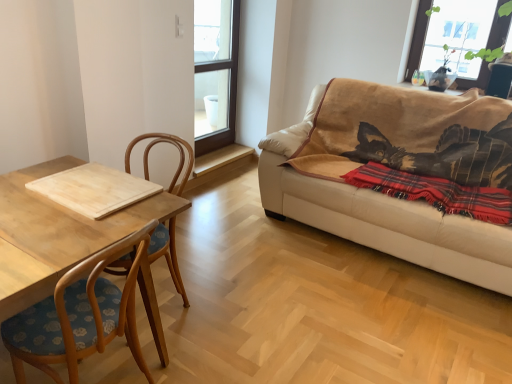
Find the location of a particular element. Image resolution: width=512 pixels, height=384 pixels. red plaid blanket at right is located at coordinates (436, 192).

What is the approximate width of light wood cutting board at left?

light wood cutting board at left is 81.60 centimeters in width.

The height and width of the screenshot is (384, 512). Find the location of `light wood cutting board at left`. light wood cutting board at left is located at coordinates (57, 234).

The image size is (512, 384). What do you see at coordinates (378, 210) in the screenshot? I see `beige leather couch at right` at bounding box center [378, 210].

You are a GUI agent. You are given a task and a screenshot of the screen. Output one action in this format:
    pyautogui.click(x=<x>, y=<y>)
    Task: Click on the beige leather couch at right
    This screenshot has width=512, height=384.
    Given the screenshot: What is the action you would take?
    pyautogui.click(x=378, y=210)

The height and width of the screenshot is (384, 512). What are the coordinates of `transparent glass window at upper right, which is the first window from right to left` in the screenshot? It's located at (418, 39).

Where is `transparent glass window at upper center, arranged as the 2th window when viewed from the right`? The image size is (512, 384). transparent glass window at upper center, arranged as the 2th window when viewed from the right is located at coordinates (215, 73).

Can you confirm if light wood cutting board at left is smaller than transparent glass window at upper right, which is counted as the second window, starting from the left?

Correct, light wood cutting board at left occupies less space than transparent glass window at upper right, which is counted as the second window, starting from the left.

How different are the orientations of light wood cutting board at left and transparent glass window at upper right, which is the first window from right to left, in degrees?

light wood cutting board at left and transparent glass window at upper right, which is the first window from right to left, are facing 1.83 degrees away from each other.

Starting from the light wood cutting board at left, which window is the 2nd one to the right? Please provide its 2D coordinates.

[(418, 39)]

Does beige leather couch at right have a lesser width compared to transparent glass window at upper right, which is the first window from right to left?

Incorrect, the width of beige leather couch at right is not less than that of transparent glass window at upper right, which is the first window from right to left.

Is transparent glass window at upper right, which is the first window from right to left, surrounded by beige leather couch at right?

No, beige leather couch at right does not contain transparent glass window at upper right, which is the first window from right to left.

Is beige leather couch at right at the right side of transparent glass window at upper right, which is counted as the second window, starting from the left?

In fact, beige leather couch at right is to the left of transparent glass window at upper right, which is counted as the second window, starting from the left.

From a real-world perspective, is beige leather couch at right under transparent glass window at upper right, which is the first window from right to left?

Correct, in the physical world, beige leather couch at right is lower than transparent glass window at upper right, which is the first window from right to left.

Is transparent glass window at upper center, which is the first window from left to right, further to the viewer compared to red plaid blanket at right?

Yes, transparent glass window at upper center, which is the first window from left to right, is further from the camera.

Is red plaid blanket at right at the back of transparent glass window at upper center, which is the first window from left to right?

That's not correct — transparent glass window at upper center, which is the first window from left to right, is not looking away from red plaid blanket at right.

At what (x,y) coordinates should I click in order to perform the action: click on blanket located below the transparent glass window at upper center, which is the first window from left to right (from the image's perspective). Please return your answer as a coordinate pair (x, y). The height and width of the screenshot is (384, 512). Looking at the image, I should click on [436, 192].

Is transparent glass window at upper center, arranged as the 2th window when viewed from the right, with red plaid blanket at right?

No, transparent glass window at upper center, arranged as the 2th window when viewed from the right, is not in contact with red plaid blanket at right.

From a real-world perspective, is red plaid blanket at right positioned above or below light wood cutting board at left?

red plaid blanket at right is below light wood cutting board at left.

Is red plaid blanket at right at the right side of light wood cutting board at left?

Yes, red plaid blanket at right is to the right of light wood cutting board at left.

From the image's perspective, does red plaid blanket at right appear higher than light wood cutting board at left?

Yes, from the image's perspective, red plaid blanket at right is above light wood cutting board at left.

Is point (418, 198) closer to viewer compared to point (64, 202)?

No.

From the image's perspective, relative to light wood cutting board at left, is transparent glass window at upper center, which is the first window from left to right, above or below?

From the image's perspective, transparent glass window at upper center, which is the first window from left to right, appears above light wood cutting board at left.

Find the location of `coffee table below the transparent glass window at upper center, which is the first window from left to right (from a real-world perspective)`. coffee table below the transparent glass window at upper center, which is the first window from left to right (from a real-world perspective) is located at coordinates (57, 234).

Measure the distance between transparent glass window at upper center, arranged as the 2th window when viewed from the right, and light wood cutting board at left.

transparent glass window at upper center, arranged as the 2th window when viewed from the right, is 2.32 meters from light wood cutting board at left.

Considering the relative sizes of transparent glass window at upper right, which is the first window from right to left, and red plaid blanket at right in the image provided, is transparent glass window at upper right, which is the first window from right to left, wider than red plaid blanket at right?

Answer: No, transparent glass window at upper right, which is the first window from right to left, is not wider than red plaid blanket at right.

Would you consider transparent glass window at upper right, which is counted as the second window, starting from the left, to be distant from red plaid blanket at right?

Yes, transparent glass window at upper right, which is counted as the second window, starting from the left, is far from red plaid blanket at right.

Which of these two, transparent glass window at upper right, which is counted as the second window, starting from the left, or red plaid blanket at right, stands shorter?

Standing shorter between the two is red plaid blanket at right.

Measure the distance from light wood cutting board at left to transparent glass window at upper center, which is the first window from left to right.

The distance of light wood cutting board at left from transparent glass window at upper center, which is the first window from left to right, is 7.35 feet.

Is light wood cutting board at left bigger than transparent glass window at upper center, which is the first window from left to right?

No, light wood cutting board at left is not bigger than transparent glass window at upper center, which is the first window from left to right.

From a real-world perspective, between light wood cutting board at left and transparent glass window at upper center, which is the first window from left to right, who is vertically lower?

light wood cutting board at left.

What's the angular difference between light wood cutting board at left and transparent glass window at upper center, which is the first window from left to right,'s facing directions?

The angular difference between light wood cutting board at left and transparent glass window at upper center, which is the first window from left to right, is 88 degrees.

The height and width of the screenshot is (384, 512). What are the coordinates of `pad that appears in front of the transparent glass window at upper right, which is the first window from right to left` in the screenshot? It's located at (94, 189).

At what (x,y) coordinates should I click in order to perform the action: click on studio couch on the left of transparent glass window at upper right, which is the first window from right to left. Please return your answer as a coordinate pair (x, y). The height and width of the screenshot is (384, 512). Looking at the image, I should click on (378, 210).

When comparing their distances from red plaid blanket at right, does light wood cutting board at left or light wood cutting board at left seem further?

light wood cutting board at left is positioned further to the anchor red plaid blanket at right.

Which object lies nearer to the anchor point transparent glass window at upper right, which is counted as the second window, starting from the left, transparent glass window at upper center, which is the first window from left to right, or red plaid blanket at right?

red plaid blanket at right is closer to transparent glass window at upper right, which is counted as the second window, starting from the left.

Considering their positions, is transparent glass window at upper right, which is counted as the second window, starting from the left, positioned closer to light wood cutting board at left than light wood cutting board at left?

light wood cutting board at left.

When comparing their distances from transparent glass window at upper right, which is counted as the second window, starting from the left, does beige leather couch at right or light wood cutting board at left seem closer?

The object closer to transparent glass window at upper right, which is counted as the second window, starting from the left, is beige leather couch at right.

Looking at the image, which one is located closer to transparent glass window at upper center, arranged as the 2th window when viewed from the right, light wood cutting board at left or transparent glass window at upper right, which is the first window from right to left?

transparent glass window at upper right, which is the first window from right to left, lies closer to transparent glass window at upper center, arranged as the 2th window when viewed from the right, than the other object.

Estimate the real-world distances between objects in this image. Which object is closer to beige leather couch at right, red plaid blanket at right or light wood cutting board at left?

red plaid blanket at right.

Estimate the real-world distances between objects in this image. Which object is closer to transparent glass window at upper center, arranged as the 2th window when viewed from the right, transparent glass window at upper right, which is the first window from right to left, or light wood cutting board at left?

transparent glass window at upper right, which is the first window from right to left, lies closer to transparent glass window at upper center, arranged as the 2th window when viewed from the right, than the other object.

Based on their spatial positions, is transparent glass window at upper right, which is the first window from right to left, or light wood cutting board at left further from beige leather couch at right?

light wood cutting board at left.

The image size is (512, 384). In order to click on studio couch between light wood cutting board at left and transparent glass window at upper right, which is counted as the second window, starting from the left, in the horizontal direction in this screenshot , I will do `click(378, 210)`.

Identify the location of studio couch between light wood cutting board at left and transparent glass window at upper center, arranged as the 2th window when viewed from the right, along the z-axis. (378, 210).

Where is `studio couch located between light wood cutting board at left and transparent glass window at upper right, which is the first window from right to left, in the left-right direction`? This screenshot has height=384, width=512. studio couch located between light wood cutting board at left and transparent glass window at upper right, which is the first window from right to left, in the left-right direction is located at coordinates (378, 210).

Where is `blanket between light wood cutting board at left and transparent glass window at upper center, arranged as the 2th window when viewed from the right, from front to back`? The width and height of the screenshot is (512, 384). blanket between light wood cutting board at left and transparent glass window at upper center, arranged as the 2th window when viewed from the right, from front to back is located at coordinates (436, 192).